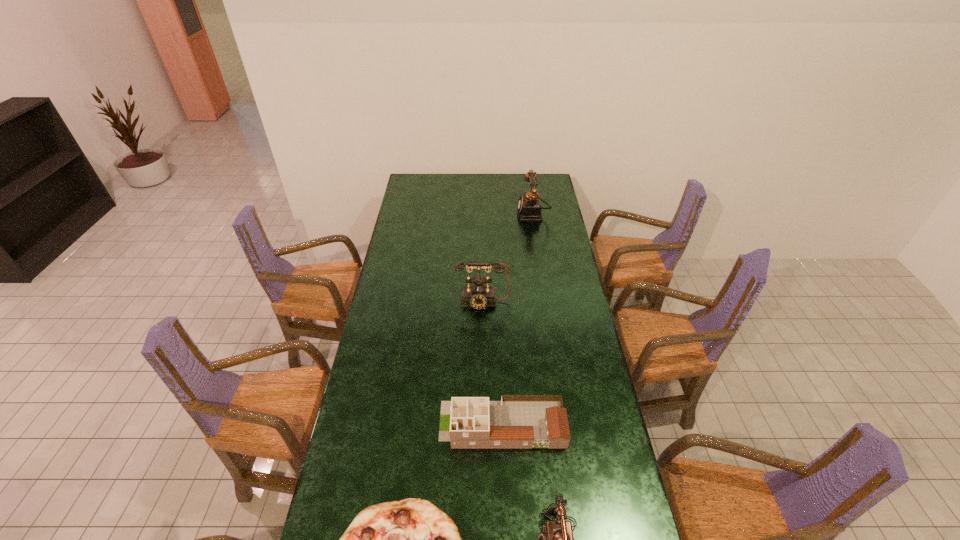
This screenshot has width=960, height=540. What are the coordinates of `free space located at the main entrance of the dollhouse` in the screenshot? It's located at (358, 424).

This screenshot has width=960, height=540. I want to click on telephone that is at the right edge, so click(x=529, y=207).

Where is `dollhouse located in the right edge section of the desktop`? This screenshot has width=960, height=540. dollhouse located in the right edge section of the desktop is located at coordinates (517, 421).

You are a GUI agent. You are given a task and a screenshot of the screen. Output one action in this format:
    pyautogui.click(x=<x>, y=<y>)
    Task: Click on the vacant space at the far edge
    This screenshot has height=540, width=960.
    Given the screenshot: What is the action you would take?
    pyautogui.click(x=470, y=193)

Locate an element on the screen. The width and height of the screenshot is (960, 540). free location at the left edge is located at coordinates (389, 404).

Find the location of a particular element. Image resolution: width=960 pixels, height=540 pixels. vacant space at the right edge of the desktop is located at coordinates (559, 241).

The width and height of the screenshot is (960, 540). Identify the location of free location at the far left corner of the desktop. (431, 195).

Locate an element on the screen. The image size is (960, 540). vacant space that is in between the leftmost telephone and the third farthest object is located at coordinates (492, 363).

The image size is (960, 540). In order to click on free space between the farthest telephone and the fourth nearest object in this screenshot , I will do `click(508, 258)`.

Find the location of a particular element. vacant area that lies between the second farthest telephone and the farthest object is located at coordinates (508, 258).